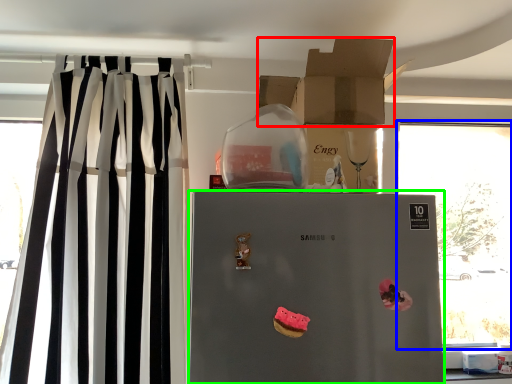
Question: Based on their relative distances, which object is nearer to cardboard box (highlighted by a red box)? Choose from window (highlighted by a blue box) and refrigerator (highlighted by a green box).

Choices:
 (A) window
 (B) refrigerator

Answer: (B)